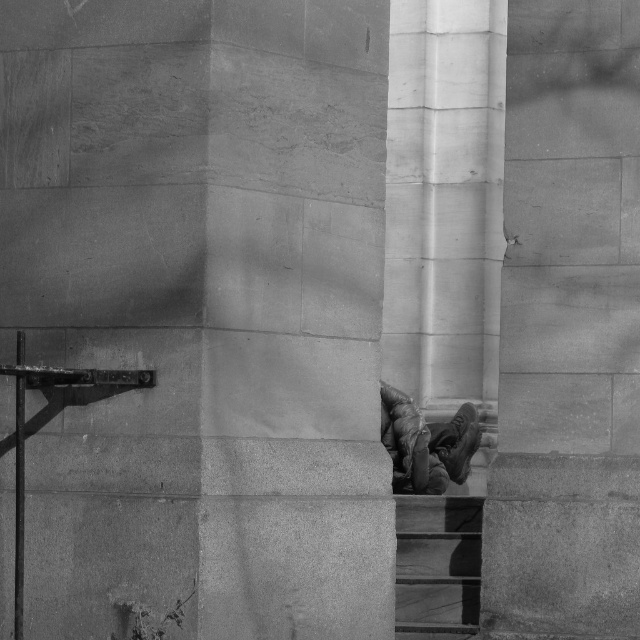
Which is more to the right, smooth stone pillar at center or leather boots at center?

leather boots at center is more to the right.

Who is positioned more to the left, smooth stone pillar at center or leather boots at center?

Positioned to the left is smooth stone pillar at center.

Between point (115, 230) and point (408, 404), which one is positioned behind?

The point (408, 404) is more distant.

The width and height of the screenshot is (640, 640). Identify the location of smooth stone pillar at center. (200, 308).

Does smooth concrete stairs at lower right appear on the right side of leather boots at center?

Incorrect, smooth concrete stairs at lower right is not on the right side of leather boots at center.

Is smooth concrete stairs at lower right shorter than leather boots at center?

Correct, smooth concrete stairs at lower right is not as tall as leather boots at center.

Is point (436, 593) more distant than point (413, 476)?

No, it is in front of (413, 476).

I want to click on smooth concrete stairs at lower right, so click(436, 566).

Is smooth stone pillar at center thinner than smooth concrete stairs at lower right?

In fact, smooth stone pillar at center might be wider than smooth concrete stairs at lower right.

Between point (296, 396) and point (404, 560), which one is positioned in front?

Point (296, 396) is in front.

The image size is (640, 640). What are the coordinates of `smooth stone pillar at center` in the screenshot? It's located at 200,308.